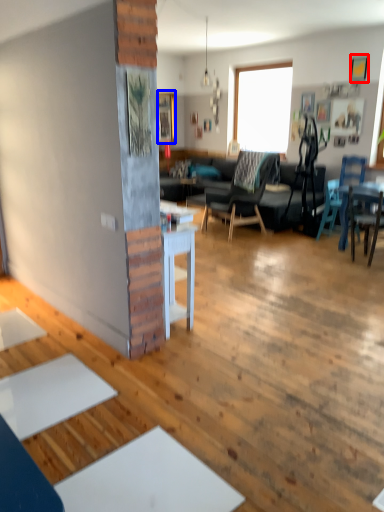
Question: Which object appears farthest to the camera in this image, picture frame (highlighted by a red box) or picture frame (highlighted by a blue box)?

Choices:
 (A) picture frame
 (B) picture frame

Answer: (B)